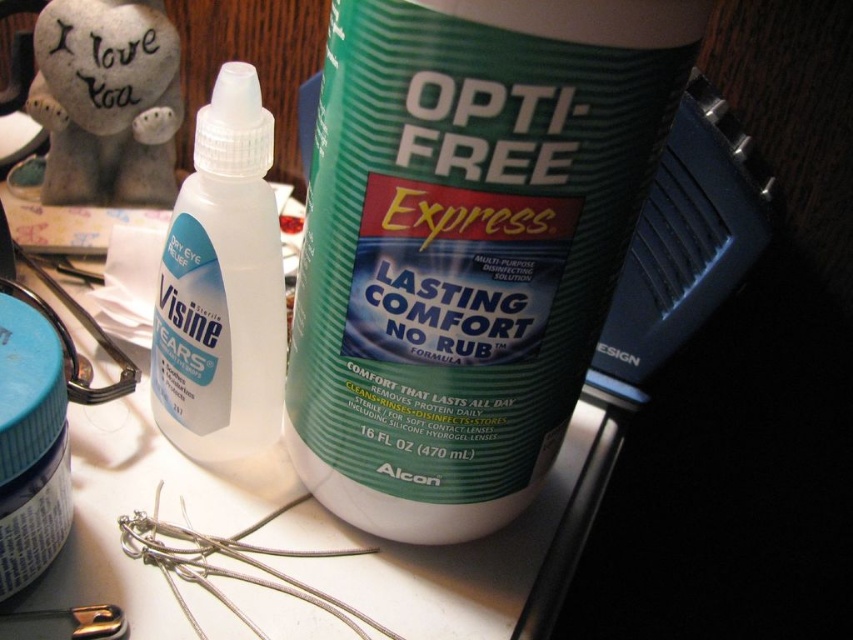
Is transparent plastic bottle at center-left further to camera compared to matte blue jar at lower left?

Yes, transparent plastic bottle at center-left is further from the viewer.

Can you confirm if transparent plastic bottle at center-left is positioned above matte blue jar at lower left?

Correct, transparent plastic bottle at center-left is located above matte blue jar at lower left.

Who is more distant from viewer, (248, 108) or (26, 541)?

The point (248, 108) is behind.

In order to click on transparent plastic bottle at center-left in this screenshot , I will do `click(222, 285)`.

Can you confirm if green plastic bottle at center is positioned above transparent plastic bottle at center-left?

No, green plastic bottle at center is not above transparent plastic bottle at center-left.

Can you confirm if green plastic bottle at center is shorter than transparent plastic bottle at center-left?

In fact, green plastic bottle at center may be taller than transparent plastic bottle at center-left.

Between point (389, 368) and point (245, 444), which one is positioned behind?

Positioned behind is point (245, 444).

At what (x,y) coordinates should I click in order to perform the action: click on green plastic bottle at center. Please return your answer as a coordinate pair (x, y). Looking at the image, I should click on (467, 243).

Who is positioned more to the left, green plastic bottle at center or matte blue jar at lower left?

From the viewer's perspective, matte blue jar at lower left appears more on the left side.

How distant is green plastic bottle at center from matte blue jar at lower left?

A distance of 24.57 centimeters exists between green plastic bottle at center and matte blue jar at lower left.

Is point (498, 396) positioned after point (13, 355)?

Yes, it is.

The height and width of the screenshot is (640, 853). I want to click on green plastic bottle at center, so click(467, 243).